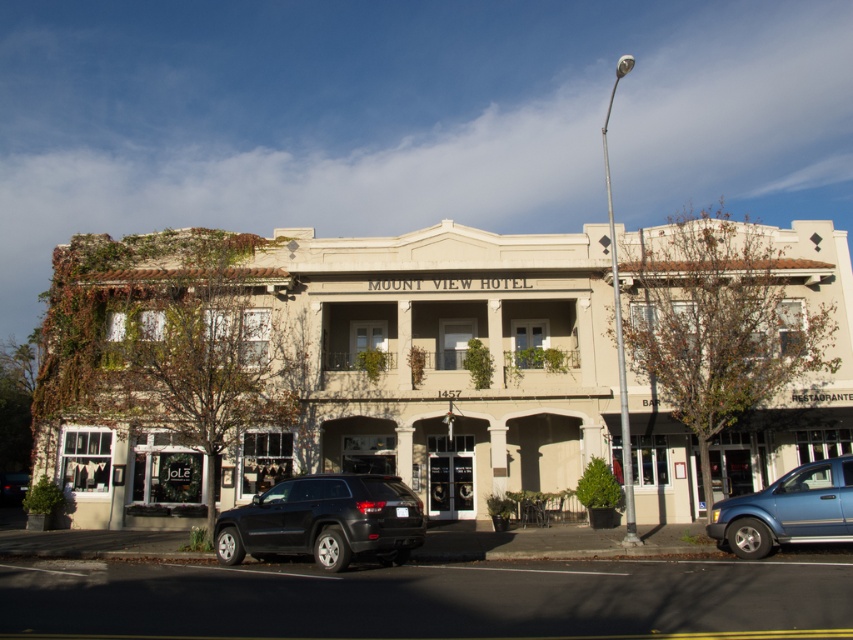
Question: Which point is farther from the camera taking this photo?

Choices:
 (A) (840, 460)
 (B) (328, 504)

Answer: (A)

Question: Can you confirm if black matte suv at center is smaller than blue metallic suv at lower right?

Choices:
 (A) yes
 (B) no

Answer: (B)

Question: Is black matte suv at center above blue metallic suv at lower right?

Choices:
 (A) no
 (B) yes

Answer: (A)

Question: Is black matte suv at center to the left of blue metallic suv at lower right from the viewer's perspective?

Choices:
 (A) yes
 (B) no

Answer: (A)

Question: Which object is farther from the camera taking this photo?

Choices:
 (A) black matte suv at center
 (B) blue metallic suv at lower right

Answer: (B)

Question: Which of the following is the farthest from the observer?

Choices:
 (A) (785, 518)
 (B) (294, 513)

Answer: (A)